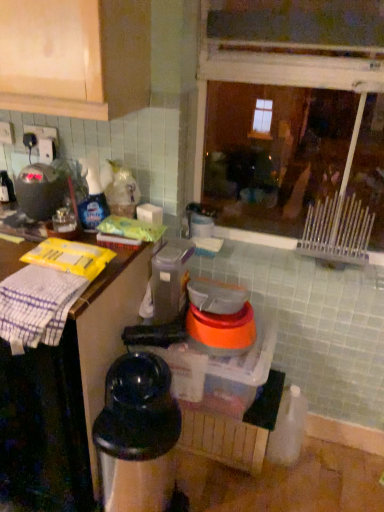
Question: Is transparent glass window at upper center positioned with its back to white cloth at left?

Choices:
 (A) yes
 (B) no

Answer: (B)

Question: Is transparent glass window at upper center thinner than white cloth at left?

Choices:
 (A) no
 (B) yes

Answer: (B)

Question: Is transparent glass window at upper center surrounding white cloth at left?

Choices:
 (A) yes
 (B) no

Answer: (B)

Question: Is the surface of transparent glass window at upper center in direct contact with white cloth at left?

Choices:
 (A) yes
 (B) no

Answer: (B)

Question: Is transparent glass window at upper center at the right side of white cloth at left?

Choices:
 (A) no
 (B) yes

Answer: (B)

Question: Is transparent glass window at upper center further to the viewer compared to white cloth at left?

Choices:
 (A) no
 (B) yes

Answer: (B)

Question: Is matte black kettle at left, which is the 3th appliance in bottom-to-top order, shorter than black plastic coffee maker at lower left, marked as the 2th appliance in a right-to-left arrangement?

Choices:
 (A) yes
 (B) no

Answer: (A)

Question: Is matte black kettle at left, which is the 3th appliance in bottom-to-top order, aimed at black plastic coffee maker at lower left, the 2th appliance in the left-to-right sequence?

Choices:
 (A) yes
 (B) no

Answer: (B)

Question: From a real-world perspective, is matte black kettle at left, marked as the 1th appliance in a top-to-bottom arrangement, on top of black plastic coffee maker at lower left, the first appliance positioned from the bottom?

Choices:
 (A) no
 (B) yes

Answer: (B)

Question: Can you confirm if matte black kettle at left, marked as the 1th appliance in a top-to-bottom arrangement, is bigger than black plastic coffee maker at lower left, the third appliance when ordered from top to bottom?

Choices:
 (A) yes
 (B) no

Answer: (B)

Question: Is matte black kettle at left, which is the 3th appliance in bottom-to-top order, facing away from black plastic coffee maker at lower left, the third appliance when ordered from top to bottom?

Choices:
 (A) yes
 (B) no

Answer: (B)

Question: Is black plastic coffee maker at lower left, the first appliance positioned from the bottom, completely or partially inside matte black kettle at left, marked as the 1th appliance in a top-to-bottom arrangement?

Choices:
 (A) yes
 (B) no

Answer: (B)

Question: Is transparent glass window at upper center at the left side of matte black kettle at left, which is the 3th appliance in bottom-to-top order?

Choices:
 (A) yes
 (B) no

Answer: (B)